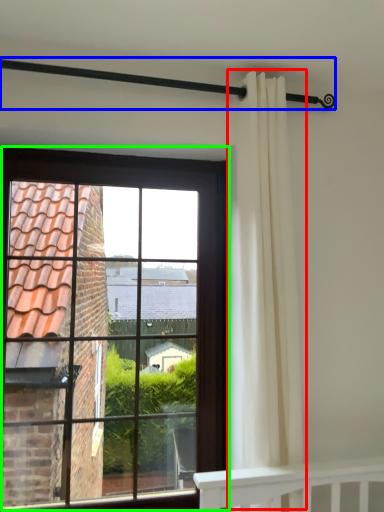
Question: Estimate the real-world distances between objects in this image. Which object is closer to curtain (highlighted by a red box), balustrade (highlighted by a blue box) or window (highlighted by a green box)?

Choices:
 (A) balustrade
 (B) window

Answer: (A)